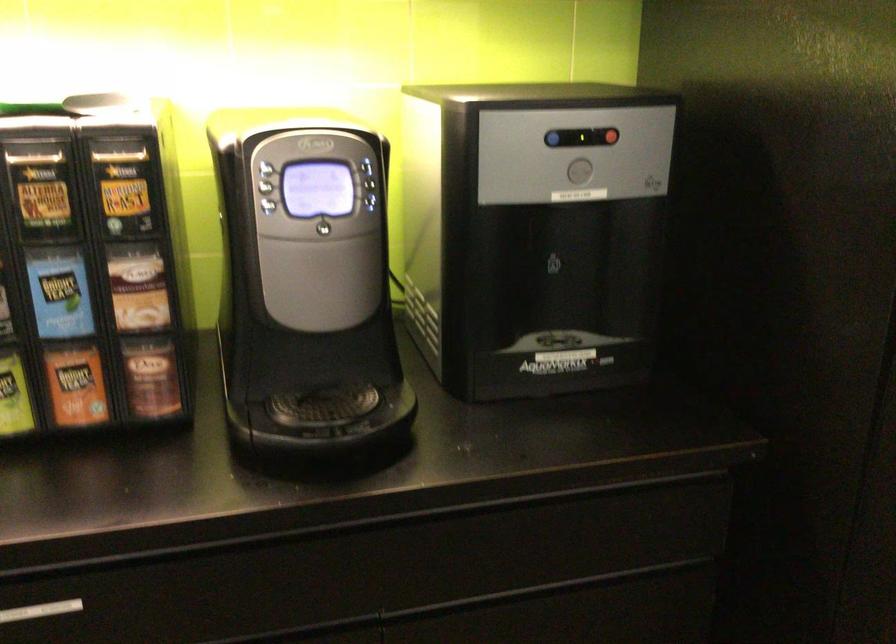
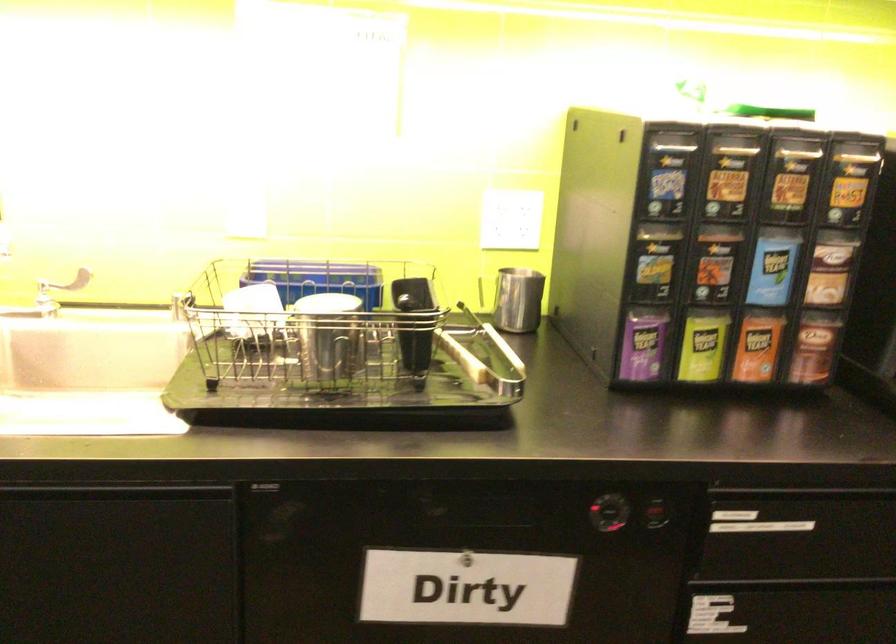
Question: The images are taken continuously from a first-person perspective. In which direction are you moving?

Choices:
 (A) Left
 (B) Right
 (C) Forward
 (D) Backward

Answer: (A)